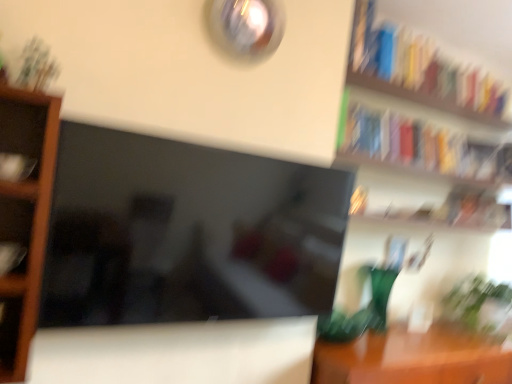
Locate an element on the screen. brown wooden table at lower right is located at coordinates (412, 358).

Where is `hardcover book at upper right, arranged as the second book when viewed from the top`? This screenshot has height=384, width=512. hardcover book at upper right, arranged as the second book when viewed from the top is located at coordinates (418, 144).

Measure the distance between hardcover book at upper right, the third book when ordered from left to right, and camera.

hardcover book at upper right, the third book when ordered from left to right, and camera are 1.65 meters apart from each other.

The width and height of the screenshot is (512, 384). Describe the element at coordinates (479, 305) in the screenshot. I see `green leafy plant at lower right` at that location.

Identify the location of green leafy plant at lower right. (479, 305).

Image resolution: width=512 pixels, height=384 pixels. Describe the element at coordinates (16, 167) in the screenshot. I see `matte black book at left, marked as the first book in a front-to-back arrangement` at that location.

Image resolution: width=512 pixels, height=384 pixels. In order to click on matte black book at left, which is the third book from back to front in this screenshot , I will do [x=11, y=256].

The width and height of the screenshot is (512, 384). Find the location of `brown wooden shelf at left`. brown wooden shelf at left is located at coordinates (26, 209).

How many degrees apart are the facing directions of hardcover book at upper right, arranged as the first book when viewed from the top, and hardcover book at upper right, positioned as the 2th book in right-to-left order?

The angular difference between hardcover book at upper right, arranged as the first book when viewed from the top, and hardcover book at upper right, positioned as the 2th book in right-to-left order, is 89.9 degrees.

Considering the relative sizes of hardcover book at upper right, the 2th book when ordered from back to front, and hardcover book at upper right, marked as the third book in a bottom-to-top arrangement, in the image provided, is hardcover book at upper right, the 2th book when ordered from back to front, shorter than hardcover book at upper right, marked as the third book in a bottom-to-top arrangement,?

Yes.

From the picture: Does hardcover book at upper right, the 4th book from the left, appear on the right side of hardcover book at upper right, arranged as the fourth book when viewed from the front?

Yes.

Is hardcover book at upper right, which appears as the third book when viewed from the front, next to hardcover book at upper right, marked as the third book in a bottom-to-top arrangement, and touching it?

hardcover book at upper right, which appears as the third book when viewed from the front, and hardcover book at upper right, marked as the third book in a bottom-to-top arrangement, are clearly separated.

Between hardcover book at upper right, arranged as the second book when viewed from the top, and brown wooden shelf at left, which one has smaller width?

brown wooden shelf at left.

Is hardcover book at upper right, marked as the third book in a bottom-to-top arrangement, positioned with its back to brown wooden shelf at left?

hardcover book at upper right, marked as the third book in a bottom-to-top arrangement, is not turned away from brown wooden shelf at left.

From the image's perspective, is hardcover book at upper right, the third book when ordered from left to right, over brown wooden shelf at left?

Indeed, from the image's perspective, hardcover book at upper right, the third book when ordered from left to right, is shown above brown wooden shelf at left.

Can you see brown wooden shelf at left touching brown wooden table at lower right?

brown wooden shelf at left is not next to brown wooden table at lower right, and they're not touching.

Measure the distance between brown wooden shelf at left and brown wooden table at lower right.

brown wooden shelf at left is 1.32 meters from brown wooden table at lower right.

Which is in front, point (49, 213) or point (375, 346)?

Positioned in front is point (49, 213).

Is brown wooden shelf at left to the right of brown wooden table at lower right from the viewer's perspective?

No.

From the image's perspective, would you say matte black book at left, the 4th book positioned from the top, is shown under hardcover book at upper right, the 2th book when ordered from back to front?

Yes.

Is matte black book at left, arranged as the 1th book when ordered from the bottom, shorter than hardcover book at upper right, the 4th book from the left?

Indeed, matte black book at left, arranged as the 1th book when ordered from the bottom, has a lesser height compared to hardcover book at upper right, the 4th book from the left.

Is matte black book at left, which is counted as the first book, starting from the left, surrounding hardcover book at upper right, which is counted as the fourth book, starting from the bottom?

No.

Based on the photo, how different are the orientations of matte black book at left, which is the third book from back to front, and hardcover book at upper right, the 2th book when ordered from back to front, in degrees?

The angular difference between matte black book at left, which is the third book from back to front, and hardcover book at upper right, the 2th book when ordered from back to front, is 92.4 degrees.

The height and width of the screenshot is (384, 512). There is a green glass vase at right. In order to click on the 3rd book above it (from the image's perspective) in this screenshot , I will do `click(418, 144)`.

Which is closer, (419, 127) or (390, 284)?

The point (419, 127) is more forward.

From the picture: Visually, is hardcover book at upper right, marked as the third book in a bottom-to-top arrangement, positioned to the left or to the right of green glass vase at right?

In the image, hardcover book at upper right, marked as the third book in a bottom-to-top arrangement, appears on the right side of green glass vase at right.

Who is shorter, hardcover book at upper right, the first book positioned from the back, or green glass vase at right?

hardcover book at upper right, the first book positioned from the back, is shorter.

Is brown wooden table at lower right aimed at matte black book at left, which ranks as the third book in right-to-left order?

No, brown wooden table at lower right is not oriented towards matte black book at left, which ranks as the third book in right-to-left order.

Is brown wooden table at lower right wider than matte black book at left, marked as the first book in a front-to-back arrangement?

Yes.

Is point (342, 344) positioned after point (35, 158)?

Yes, point (342, 344) is farther from viewer.

Does brown wooden shelf at left contain hardcover book at upper right, arranged as the first book when viewed from the top?

No, brown wooden shelf at left does not contain hardcover book at upper right, arranged as the first book when viewed from the top.

From a real-world perspective, is brown wooden shelf at left positioned under hardcover book at upper right, arranged as the first book when viewed from the top, based on gravity?

Yes.

Could you tell me if brown wooden shelf at left is facing hardcover book at upper right, which is counted as the fourth book, starting from the bottom?

No, brown wooden shelf at left is not facing towards hardcover book at upper right, which is counted as the fourth book, starting from the bottom.

You are a GUI agent. You are given a task and a screenshot of the screen. Output one action in this format:
    pyautogui.click(x=<x>, y=<y>)
    Task: Click on the book behind the hardcover book at upper right, the 2th book when ordered from back to front
    The width and height of the screenshot is (512, 384).
    Given the screenshot: What is the action you would take?
    pyautogui.click(x=418, y=144)

Locate an element on the screen. The width and height of the screenshot is (512, 384). book that is the 2nd object located above the brown wooden shelf at left (from the image's perspective) is located at coordinates (418, 144).

Estimate the real-world distances between objects in this image. Which object is further from matte black book at left, the 4th book positioned from the top, hardcover book at upper right, marked as the third book in a bottom-to-top arrangement, or green glass vase at right?

The object further to matte black book at left, the 4th book positioned from the top, is hardcover book at upper right, marked as the third book in a bottom-to-top arrangement.

Which object lies further to the anchor point green glass vase at right, hardcover book at upper right, the 2th book when ordered from back to front, or matte black book at left, which is the third book from back to front?

matte black book at left, which is the third book from back to front.

Considering their positions, is brown wooden shelf at left positioned further to hardcover book at upper right, the 4th book from the left, than green glass vase at right?

brown wooden shelf at left is positioned further to the anchor hardcover book at upper right, the 4th book from the left.

Considering their positions, is hardcover book at upper right, marked as the third book in a bottom-to-top arrangement, positioned closer to green leafy plant at lower right than hardcover book at upper right, the 2th book when ordered from back to front?

hardcover book at upper right, marked as the third book in a bottom-to-top arrangement, is closer to green leafy plant at lower right.

Which object lies further to the anchor point hardcover book at upper right, the third book when ordered from left to right, brown wooden shelf at left or brown wooden table at lower right?

brown wooden shelf at left lies further to hardcover book at upper right, the third book when ordered from left to right, than the other object.

Considering their positions, is green leafy plant at lower right positioned further to matte black book at left, the 4th book positioned from the top, than brown wooden shelf at left?

Based on the image, green leafy plant at lower right appears to be further to matte black book at left, the 4th book positioned from the top.

When comparing their distances from hardcover book at upper right, the first book viewed from the right, does brown wooden shelf at left or hardcover book at upper right, the third book when ordered from left to right, seem further?

The object further to hardcover book at upper right, the first book viewed from the right, is brown wooden shelf at left.

Looking at the image, which one is located further to brown wooden table at lower right, hardcover book at upper right, the 2th book when ordered from back to front, or matte black book at left, positioned as the 4th book in back-to-front order?

matte black book at left, positioned as the 4th book in back-to-front order, lies further to brown wooden table at lower right than the other object.

I want to click on glass vase between matte black book at left, which is counted as the first book, starting from the left, and hardcover book at upper right, which appears as the third book when viewed from the front, from left to right, so click(x=378, y=293).

The height and width of the screenshot is (384, 512). I want to click on table situated between brown wooden shelf at left and hardcover book at upper right, the first book viewed from the right, from left to right, so click(412, 358).

This screenshot has height=384, width=512. Find the location of `book located between brown wooden shelf at left and green glass vase at right in the left-right direction`. book located between brown wooden shelf at left and green glass vase at right in the left-right direction is located at coordinates (16, 167).

I want to click on table located between brown wooden shelf at left and green leafy plant at lower right in the left-right direction, so click(x=412, y=358).